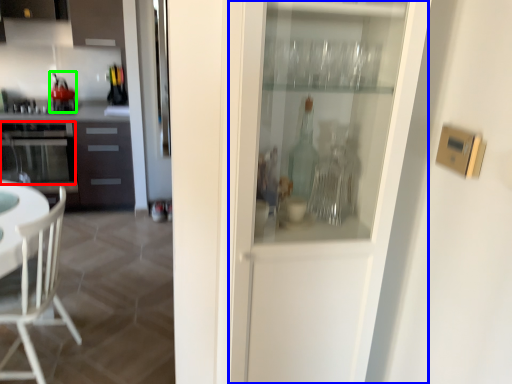
Question: Which object is positioned closest to oven (highlighted by a red box)? Select from screen door (highlighted by a blue box) and appliance (highlighted by a green box).

Choices:
 (A) screen door
 (B) appliance

Answer: (B)